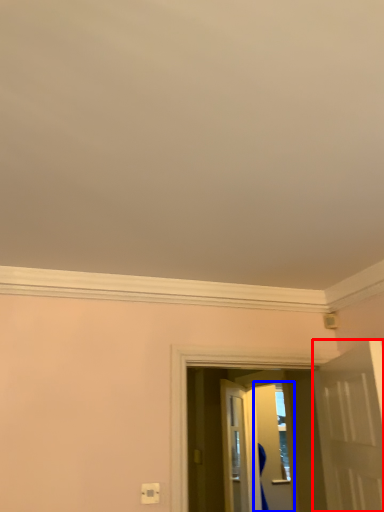
Question: Among these objects, which one is farthest to the camera, door (highlighted by a red box) or screen door (highlighted by a blue box)?

Choices:
 (A) door
 (B) screen door

Answer: (B)